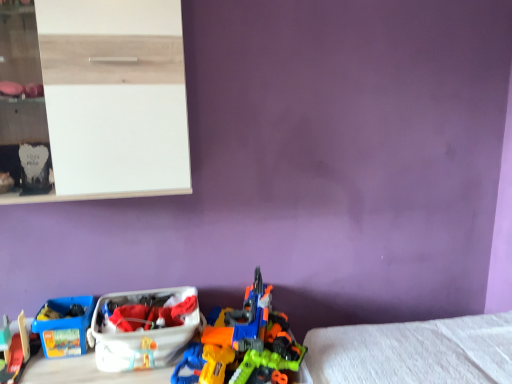
Locate an element on the screen. The image size is (512, 384). vacant space to the right of smooth plastic toy train at lower left, which is the first toy from left to right is located at coordinates (59, 370).